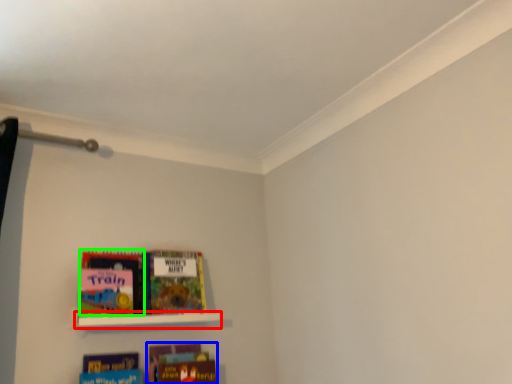
Question: Considering the real-world distances, which object is closest to shelf (highlighted by a red box)? book (highlighted by a blue box) or book (highlighted by a green box).

Choices:
 (A) book
 (B) book

Answer: (B)